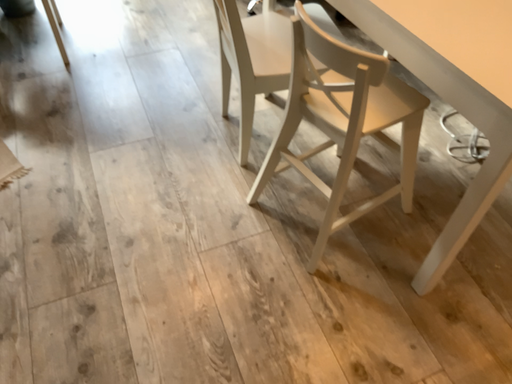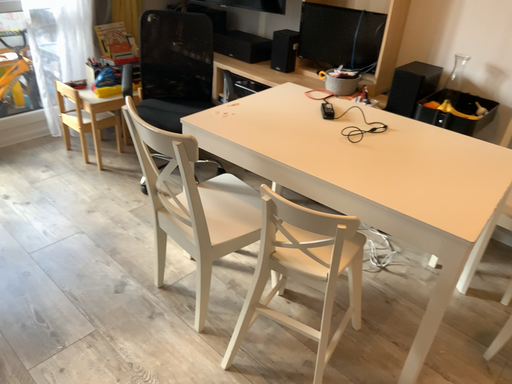
Question: Which way did the camera rotate in the video?

Choices:
 (A) rotated downward
 (B) rotated upward

Answer: (B)